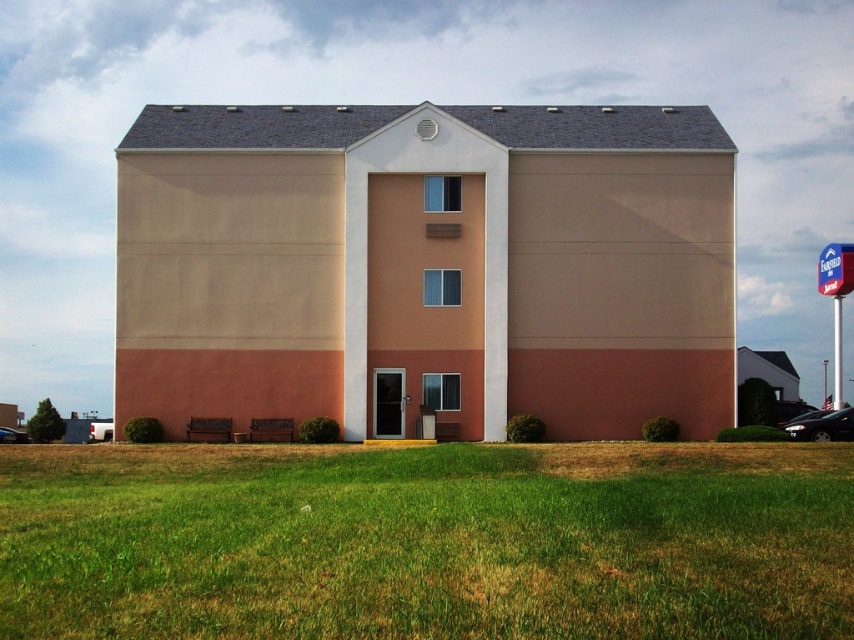
You are standing in front of the two story building with beige upper and reddish brown lower sections. You see a point at coordinate (683, 548). Can you tell me how far this point is from you?

The point at coordinate (683, 548) is 7.84 meters away from the camera.

You are a gardener who needs to mow the lawn. You see the green grass at lower center and the black glossy car at lower right. Which area should you focus on first, and why?

You should focus on the green grass at lower center first because it is larger than the black glossy car at lower right, meaning there is more grass to mow in that area.

You are standing at the entrance of the two story building and want to walk to the green grass at lower center. What direction should you walk in?

Since the green grass at lower center is located at point (427, 540) in the image, you should walk forward from the entrance to reach it.